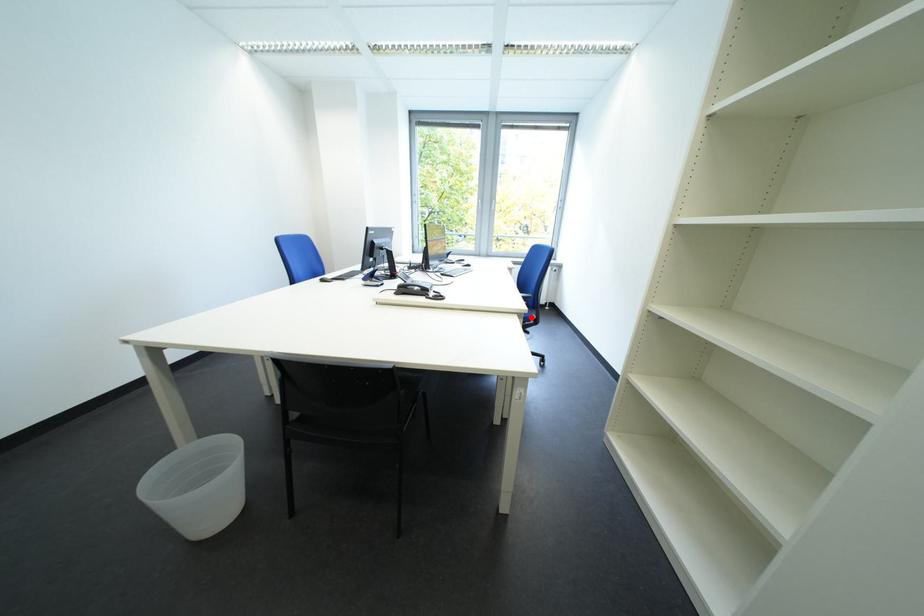
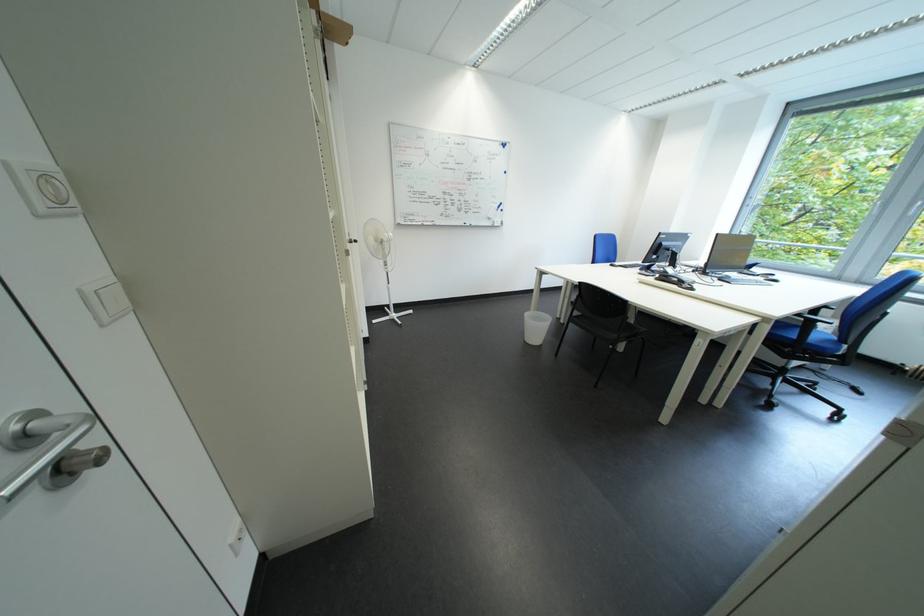
In the second image, find the point that corresponds to the highlighted location in the first image.

(777, 322)